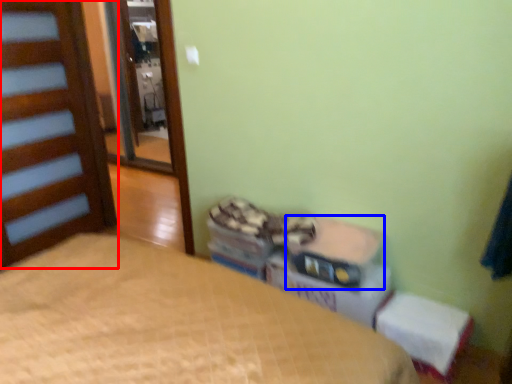
Question: Among these objects, which one is farthest to the camera, door (highlighted by a red box) or storage box (highlighted by a blue box)?

Choices:
 (A) door
 (B) storage box

Answer: (A)